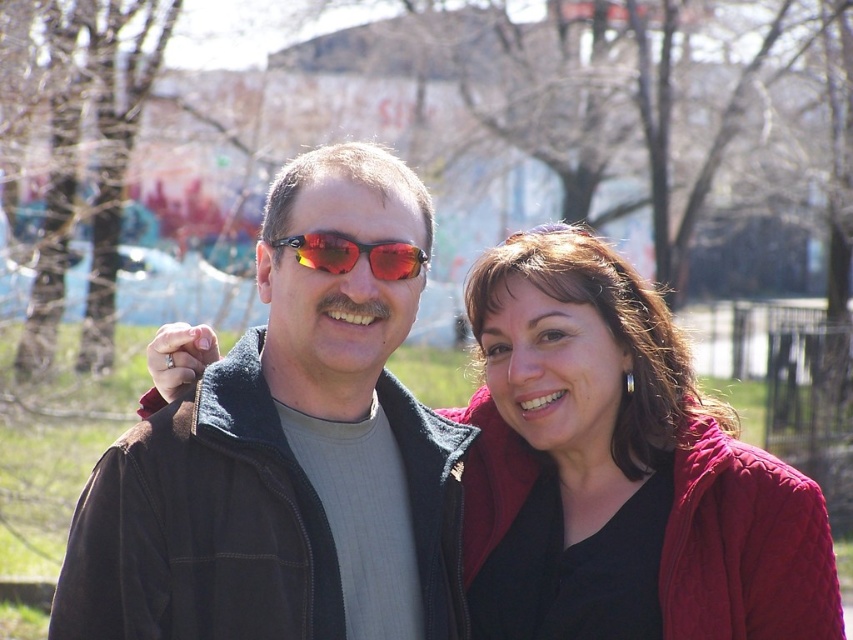
From the picture: Which of these two, matte black jacket at center or red reflective lens sunglasses at center, stands shorter?

red reflective lens sunglasses at center

Between point (305, 358) and point (389, 244), which one is positioned in front?

Point (389, 244) is more forward.

Identify the location of matte black jacket at center. (286, 456).

Does matte black jacket at center have a lesser height compared to corduroy red jacket at center?

No, matte black jacket at center is not shorter than corduroy red jacket at center.

This screenshot has width=853, height=640. What do you see at coordinates (286, 456) in the screenshot? I see `matte black jacket at center` at bounding box center [286, 456].

Between point (154, 486) and point (782, 620), which one is positioned behind?

Positioned behind is point (782, 620).

Where is `matte black jacket at center`? The image size is (853, 640). matte black jacket at center is located at coordinates (286, 456).

Is corduroy red jacket at center behind red reflective lens sunglasses at center?

Yes, corduroy red jacket at center is further from the viewer.

Can you confirm if corduroy red jacket at center is shorter than red reflective lens sunglasses at center?

In fact, corduroy red jacket at center may be taller than red reflective lens sunglasses at center.

Find the location of `corduroy red jacket at center`. corduroy red jacket at center is located at coordinates (619, 470).